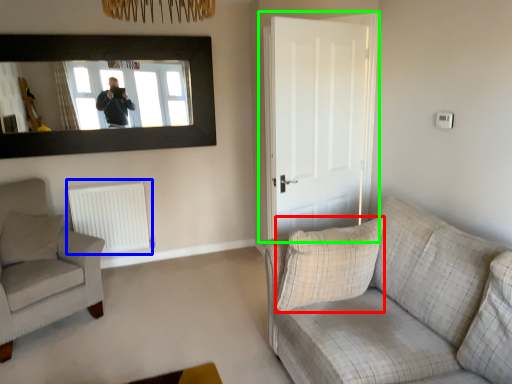
Question: Based on their relative distances, which object is farther from pillow (highlighted by a red box)? Choose from radiator (highlighted by a blue box) and door (highlighted by a green box).

Choices:
 (A) radiator
 (B) door

Answer: (A)